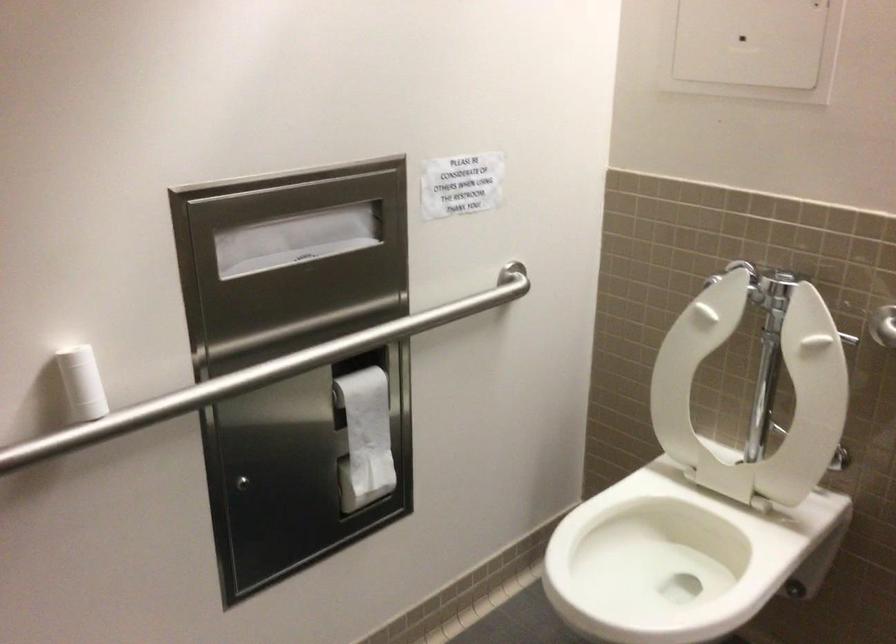
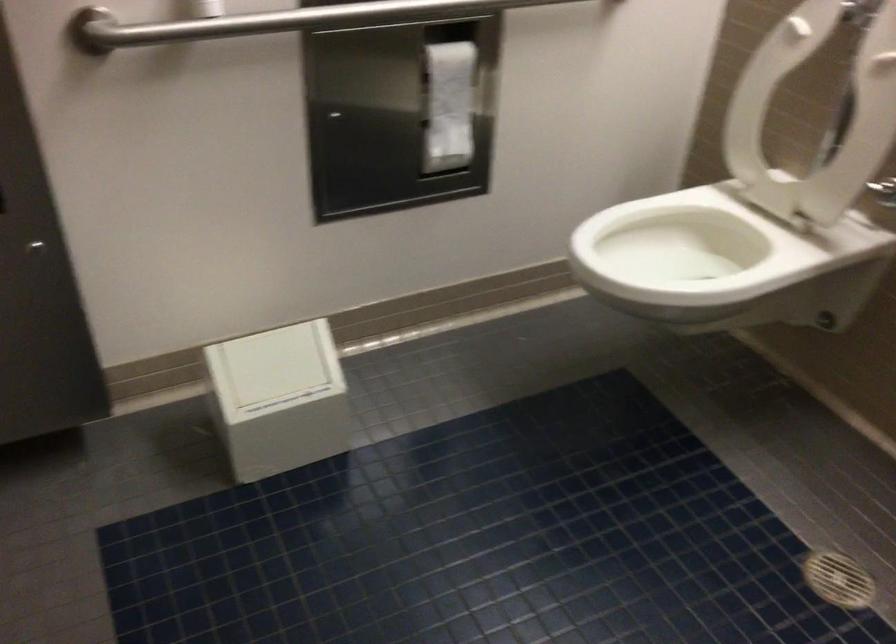
The point at (642,538) is marked in the first image. Where is the corresponding point in the second image?

(684, 245)